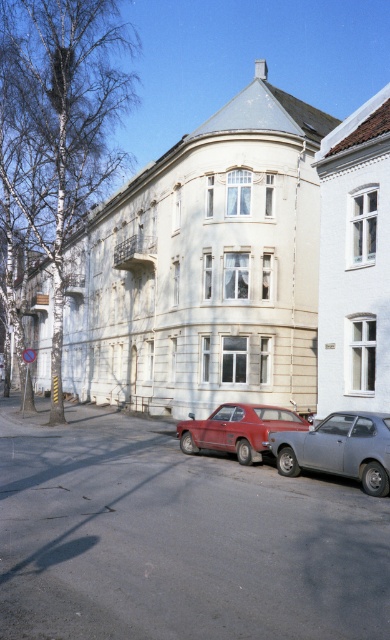
You are a pedestrian standing on the sidewalk and want to cross the street to reach the building with the curved corner. There are two cars parked here, the matte gray hatchback at center and the matte red station wagon at center. Which car is closer to the building with the curved corner?

The matte gray hatchback at center is to the right of the matte red station wagon at center. Since the building with the curved corner is in the center of the street scene, the matte red station wagon at center is closer to it.

You are standing on the street looking at the row of buildings. There are two points marked on the image. One is at point [336,468] and the other is at point [242,448]. Which of these two points is closer to you?

Point [336,468] is closer to the viewer than point [242,448].